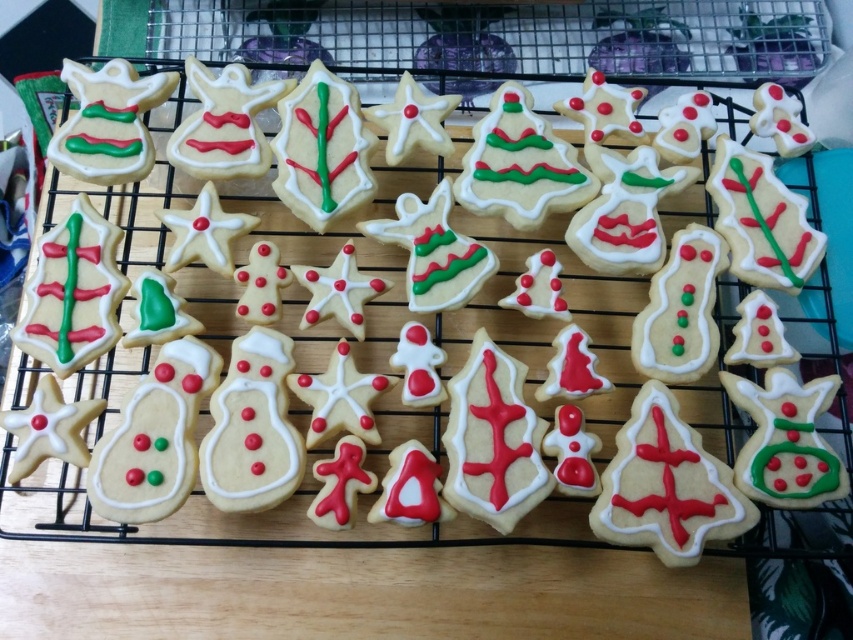
Image resolution: width=853 pixels, height=640 pixels. Describe the element at coordinates (666, 484) in the screenshot. I see `white glossy christmas tree at center` at that location.

Who is more forward, (631, 531) or (744, 163)?

Point (631, 531) is in front.

Is point (589, 515) more distant than point (772, 232)?

No, it is in front of (772, 232).

Identify the location of white glossy christmas tree at center. The height and width of the screenshot is (640, 853). (666, 484).

Can you confirm if white glossy christmas tree at center is bigger than matte white gingerbread at upper left?

Yes.

Locate an element on the screen. This screenshot has height=640, width=853. white glossy christmas tree at center is located at coordinates (666, 484).

Who is more distant from viewer, (x=677, y=557) or (x=84, y=120)?

Positioned behind is point (x=84, y=120).

Locate an element on the screen. white glossy christmas tree at center is located at coordinates (666, 484).

Does white glossy christmas tree at center appear over matte white gingerbread at center?

Actually, white glossy christmas tree at center is below matte white gingerbread at center.

Between white glossy christmas tree at center and matte white gingerbread at center, which one has more height?

matte white gingerbread at center

The image size is (853, 640). What do you see at coordinates (666, 484) in the screenshot?
I see `white glossy christmas tree at center` at bounding box center [666, 484].

The width and height of the screenshot is (853, 640). What are the coordinates of `white glossy christmas tree at center` in the screenshot? It's located at (666, 484).